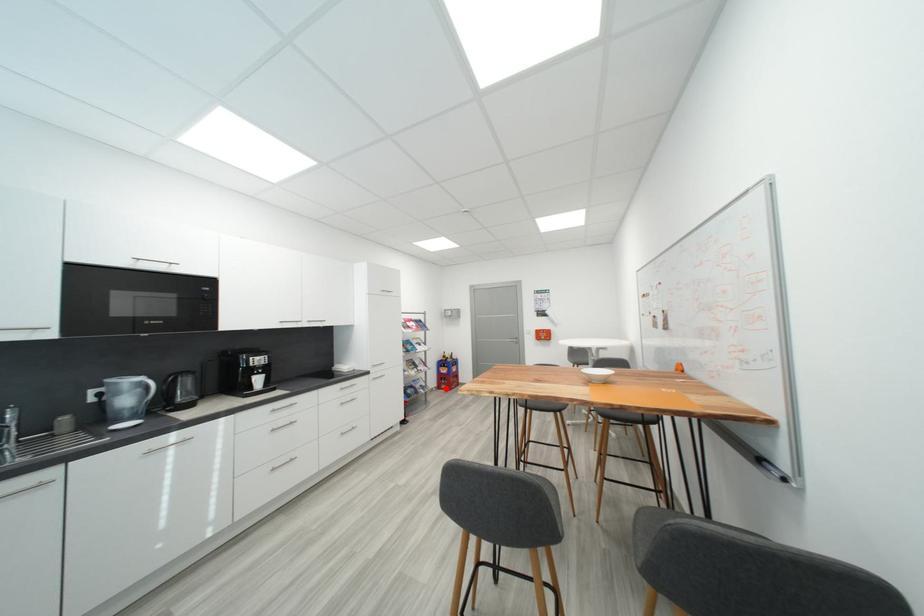
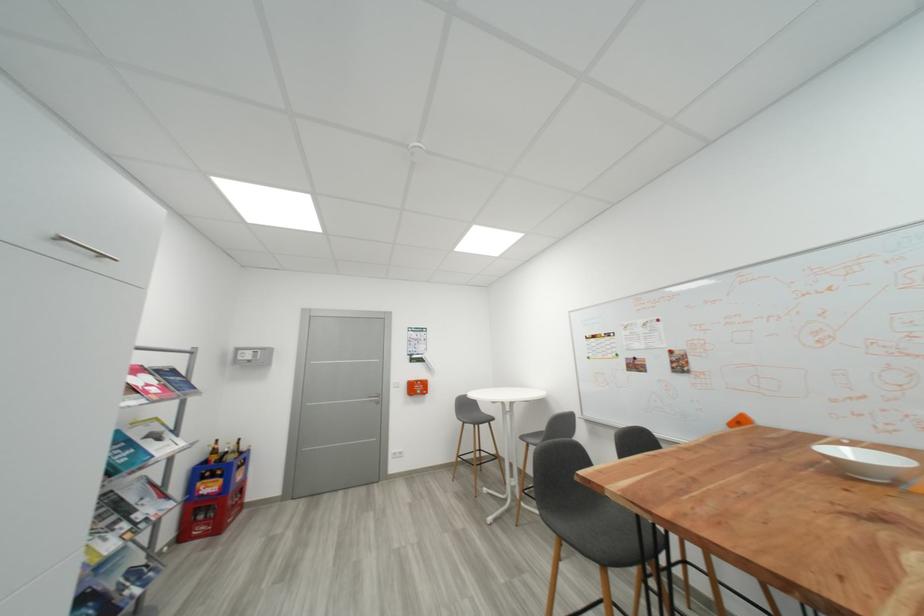
Locate, in the second image, the point that corresponds to the highlighted location in the first image.

(189, 538)